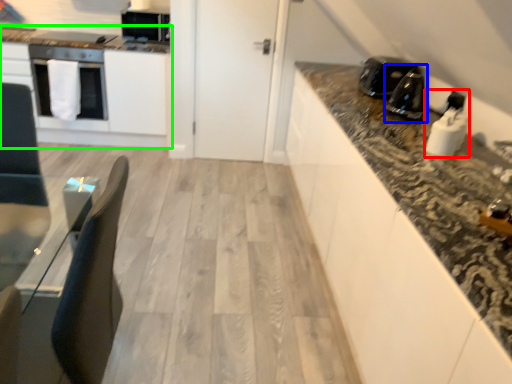
Question: Which object is positioned farthest from appliance (highlighted by a red box)? Select from appliance (highlighted by a blue box) and cabinetry (highlighted by a green box).

Choices:
 (A) appliance
 (B) cabinetry

Answer: (B)